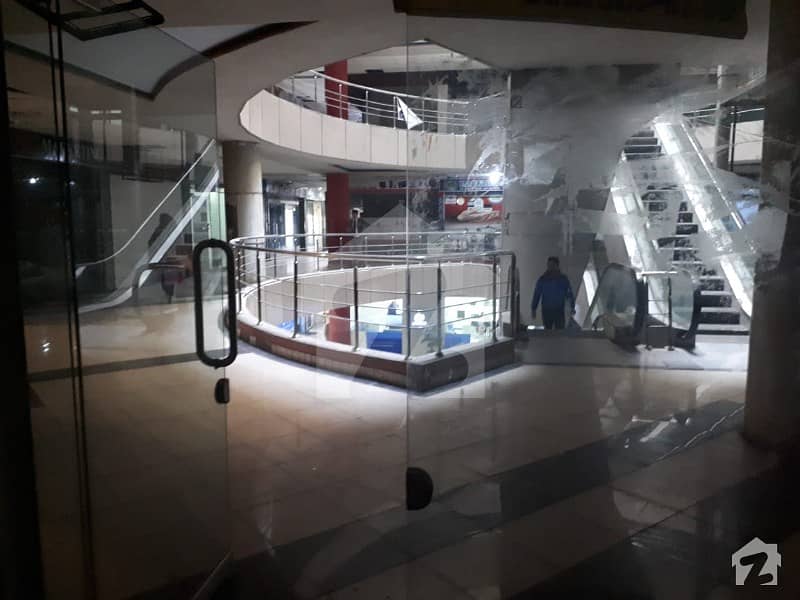
Where is `handles`? handles is located at coordinates (234, 288).